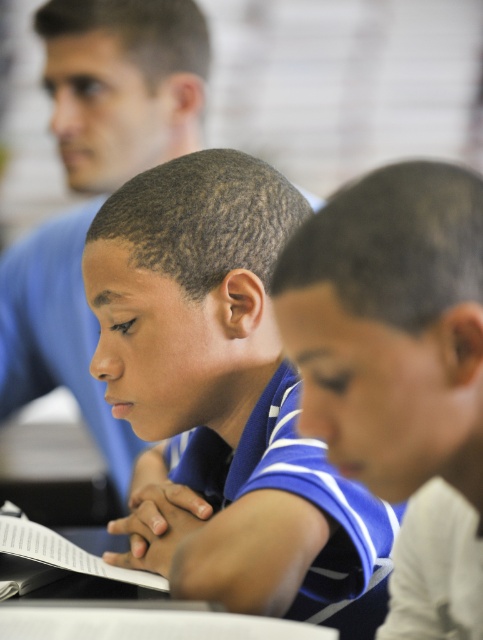
Question: Is blue jersey at center behind blue shirt at upper left?

Choices:
 (A) yes
 (B) no

Answer: (B)

Question: Which object is the farthest from the blue striped polo shirt at center?

Choices:
 (A) blue jersey at center
 (B) blue shirt at upper left

Answer: (B)

Question: Among these points, which one is nearest to the camera?

Choices:
 (A) (208, 433)
 (B) (16, 336)
 (C) (389, 193)

Answer: (C)

Question: Does blue striped polo shirt at center have a larger size compared to blue shirt at upper left?

Choices:
 (A) yes
 (B) no

Answer: (A)

Question: Among these points, which one is farthest from the camera?

Choices:
 (A) (468, 385)
 (B) (11, 289)
 (C) (241, 257)

Answer: (B)

Question: Is blue striped polo shirt at center below blue shirt at upper left?

Choices:
 (A) no
 (B) yes

Answer: (B)